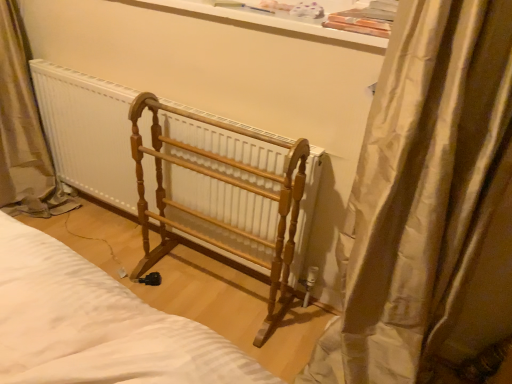
Measure the distance between point (273, 18) and camera.

Point (273, 18) and camera are 4.31 feet apart from each other.

Describe the element at coordinates (269, 22) in the screenshot. I see `white glossy window sill at upper center` at that location.

The image size is (512, 384). What do you see at coordinates (88, 132) in the screenshot? I see `wooden radiator at center` at bounding box center [88, 132].

Locate an element on the screen. white glossy window sill at upper center is located at coordinates (269, 22).

Between white glossy window sill at upper center and light brown wood rack at center, which one has larger size?

light brown wood rack at center.

How different are the orientations of white glossy window sill at upper center and light brown wood rack at center in degrees?

The angular difference between white glossy window sill at upper center and light brown wood rack at center is 0.82 degrees.

I want to click on furniture in front of the white glossy window sill at upper center, so click(x=224, y=195).

Is point (207, 8) closer to camera compared to point (216, 237)?

Yes, point (207, 8) is in front of point (216, 237).

Which of these two, light brown wood rack at center or wooden radiator at center, is smaller?

Smaller between the two is wooden radiator at center.

From the image's perspective, which one is positioned lower, light brown wood rack at center or wooden radiator at center?

light brown wood rack at center.

From a real-world perspective, is light brown wood rack at center on top of wooden radiator at center?

Yes, from a real-world perspective, light brown wood rack at center is over wooden radiator at center

Can you confirm if wooden radiator at center is shorter than silky beige curtain at right?

Yes, wooden radiator at center is shorter than silky beige curtain at right.

How many degrees apart are the facing directions of wooden radiator at center and silky beige curtain at right?

There is a 0.114-degree angle between the facing directions of wooden radiator at center and silky beige curtain at right.

Is wooden radiator at center wider than silky beige curtain at right?

In fact, wooden radiator at center might be narrower than silky beige curtain at right.

Locate an element on the screen. curtain that appears below the wooden radiator at center (from the image's perspective) is located at coordinates (429, 204).

Can you tell me how much silky beige curtain at right and white glossy window sill at upper center differ in facing direction?

0.447 degrees separate the facing orientations of silky beige curtain at right and white glossy window sill at upper center.

Considering the sizes of objects silky beige curtain at right and white glossy window sill at upper center in the image provided, who is bigger, silky beige curtain at right or white glossy window sill at upper center?

silky beige curtain at right.

Consider the image. Between silky beige curtain at right and white glossy window sill at upper center, which one has larger width?

silky beige curtain at right is wider.

Between white glossy window sill at upper center and wooden radiator at center, which one has smaller width?

wooden radiator at center is thinner.

Considering the sizes of objects white glossy window sill at upper center and wooden radiator at center in the image provided, who is shorter, white glossy window sill at upper center or wooden radiator at center?

Standing shorter between the two is white glossy window sill at upper center.

From the image's perspective, between white glossy window sill at upper center and wooden radiator at center, which one is located above?

From the image's view, white glossy window sill at upper center is above.

Can we say white glossy window sill at upper center lies outside wooden radiator at center?

white glossy window sill at upper center lies outside wooden radiator at center's area.

From a real-world perspective, who is located lower, white glossy window sill at upper center or silky beige curtain at right?

In real-world perspective, silky beige curtain at right is lower.

Where is `window sill that appears above the silky beige curtain at right (from the image's perspective)`? This screenshot has width=512, height=384. window sill that appears above the silky beige curtain at right (from the image's perspective) is located at coordinates point(269,22).

From the image's perspective, is white glossy window sill at upper center above or below silky beige curtain at right?

From the image's perspective, white glossy window sill at upper center appears above silky beige curtain at right.

How many degrees apart are the facing directions of white glossy window sill at upper center and silky beige curtain at right?

The facing directions of white glossy window sill at upper center and silky beige curtain at right are 0.447 degrees apart.

How many degrees apart are the facing directions of silky beige curtain at right and light brown wood rack at center?

1.27 degrees separate the facing orientations of silky beige curtain at right and light brown wood rack at center.

Based on the photo, from the image's perspective, does silky beige curtain at right appear higher than light brown wood rack at center?

No, from the image's perspective, silky beige curtain at right is not over light brown wood rack at center.

Is silky beige curtain at right smaller than light brown wood rack at center?

Actually, silky beige curtain at right might be larger than light brown wood rack at center.

I want to click on window sill behind the light brown wood rack at center, so pos(269,22).

I want to click on radiator that is under the light brown wood rack at center (from a real-world perspective), so click(88, 132).

Looking at the image, which one is located further to wooden radiator at center, light brown wood rack at center or silky beige curtain at right?

The object further to wooden radiator at center is silky beige curtain at right.

Which object lies nearer to the anchor point wooden radiator at center, silky beige curtain at right or light brown wood rack at center?

The object closer to wooden radiator at center is light brown wood rack at center.

Which object lies nearer to the anchor point wooden radiator at center, light brown wood rack at center or white glossy window sill at upper center?

Among the two, light brown wood rack at center is located nearer to wooden radiator at center.

Estimate the real-world distances between objects in this image. Which object is further from silky beige curtain at right, light brown wood rack at center or wooden radiator at center?

The object further to silky beige curtain at right is wooden radiator at center.

Which object lies nearer to the anchor point white glossy window sill at upper center, light brown wood rack at center or silky beige curtain at right?

silky beige curtain at right lies closer to white glossy window sill at upper center than the other object.

Based on their spatial positions, is white glossy window sill at upper center or light brown wood rack at center further from wooden radiator at center?

Among the two, white glossy window sill at upper center is located further to wooden radiator at center.

Based on their spatial positions, is light brown wood rack at center or wooden radiator at center closer to white glossy window sill at upper center?

light brown wood rack at center is positioned closer to the anchor white glossy window sill at upper center.

Looking at the image, which one is located further to light brown wood rack at center, wooden radiator at center or white glossy window sill at upper center?

white glossy window sill at upper center lies further to light brown wood rack at center than the other object.

Locate an element on the screen. radiator between white glossy window sill at upper center and light brown wood rack at center in the vertical direction is located at coordinates (88, 132).

Where is `furniture between white glossy window sill at upper center and silky beige curtain at right vertically`? This screenshot has width=512, height=384. furniture between white glossy window sill at upper center and silky beige curtain at right vertically is located at coordinates (x=224, y=195).

Where is `window sill between silky beige curtain at right and wooden radiator at center along the z-axis`? This screenshot has width=512, height=384. window sill between silky beige curtain at right and wooden radiator at center along the z-axis is located at coordinates (269, 22).

At what (x,y) coordinates should I click in order to perform the action: click on furniture situated between wooden radiator at center and silky beige curtain at right from left to right. Please return your answer as a coordinate pair (x, y). The height and width of the screenshot is (384, 512). Looking at the image, I should click on (224, 195).